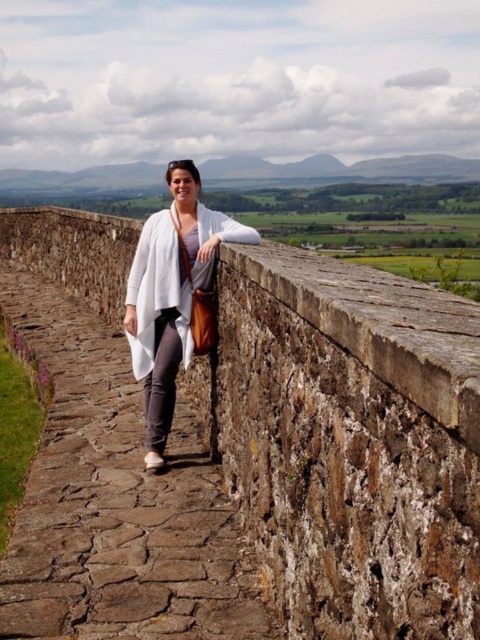
You are a painter who wants to paint the brown stone wall at center and the white matte cardigan at center. Which object requires more horizontal space on your canvas to accurately depict its full width?

The brown stone wall at center requires more horizontal space on the canvas because its width surpasses that of the white matte cardigan at center.

You are a photographer trying to capture the brown stone wall at center and the white matte cardigan at center in a single shot. Can you position yourself so that both objects are fully visible in the frame without any part of them being cut off?

The brown stone wall at center is in front of the white matte cardigan at center, so if you position yourself behind the white matte cardigan at center and face towards the brown stone wall at center, both objects will be visible in the frame.

What are the coordinates of the brown stone wall at center?

The brown stone wall at center is located at point (349, 442).